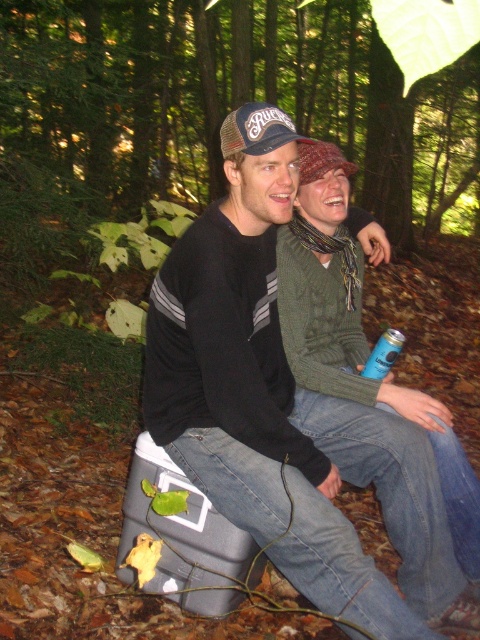
Which is more to the right, black knit sweater at center or green knitted sweater at center?

Positioned to the right is green knitted sweater at center.

Between black knit sweater at center and green knitted sweater at center, which one has more height?

black knit sweater at center

Between point (346, 432) and point (370, 388), which one is positioned in front?

Point (346, 432) is more forward.

Locate an element on the screen. black knit sweater at center is located at coordinates (286, 410).

Can you confirm if green knitted sweater at center is wider than blue matte can at lower center?

Yes.

Between green knitted sweater at center and blue matte can at lower center, which one appears on the left side from the viewer's perspective?

green knitted sweater at center

Identify the location of green knitted sweater at center. (356, 332).

Is black knit sweater at center below blue matte can at lower center?

Correct, black knit sweater at center is located below blue matte can at lower center.

Locate an element on the screen. black knit sweater at center is located at coordinates (286, 410).

Image resolution: width=480 pixels, height=640 pixels. I want to click on black knit sweater at center, so click(x=286, y=410).